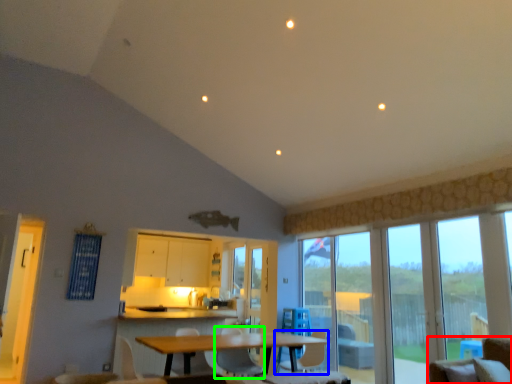
Question: Based on their relative distances, which object is nearer to chair (highlighted by a red box)? Choose from chair (highlighted by a blue box) and chair (highlighted by a green box).

Choices:
 (A) chair
 (B) chair

Answer: (A)